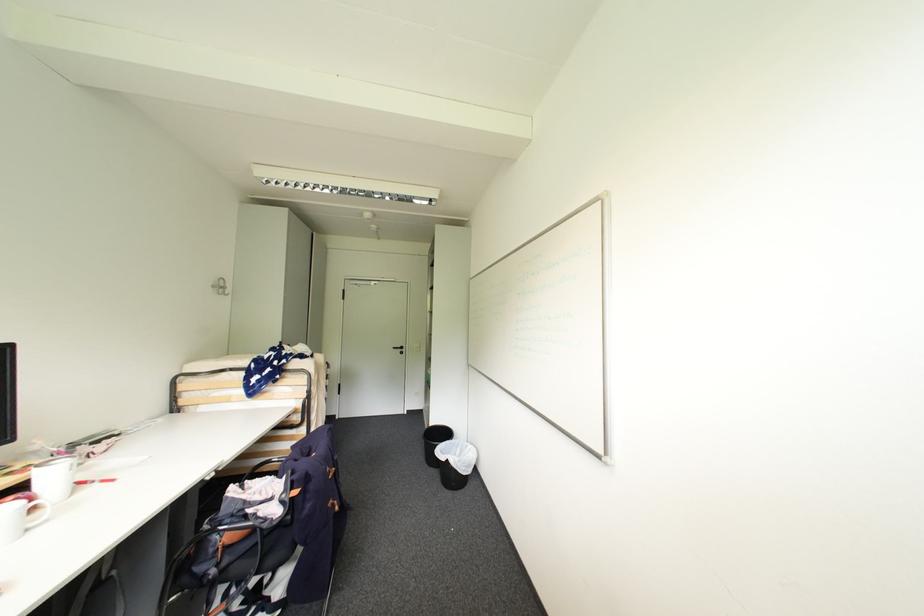
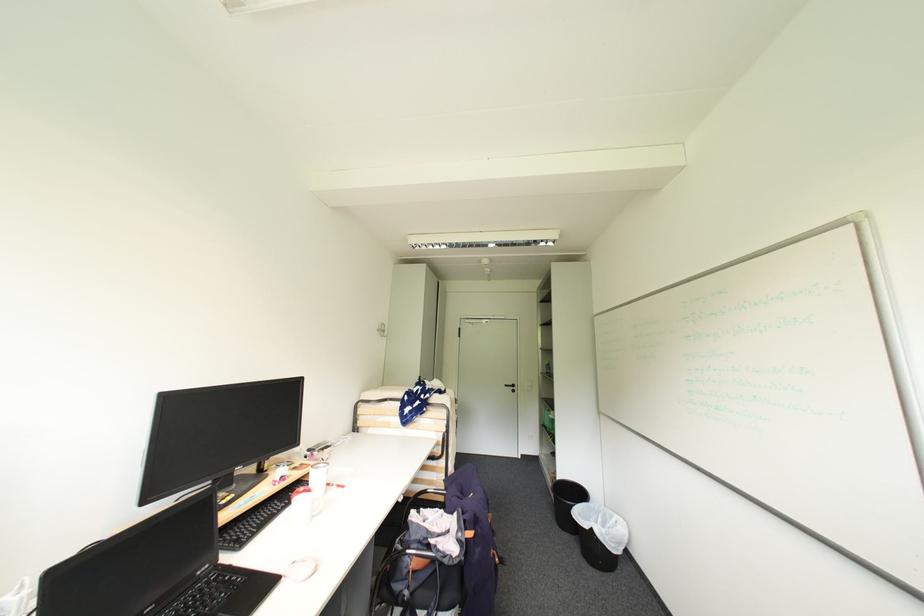
The images are taken continuously from a first-person perspective. In which direction are you moving?

The cameraman moved toward left, backward.